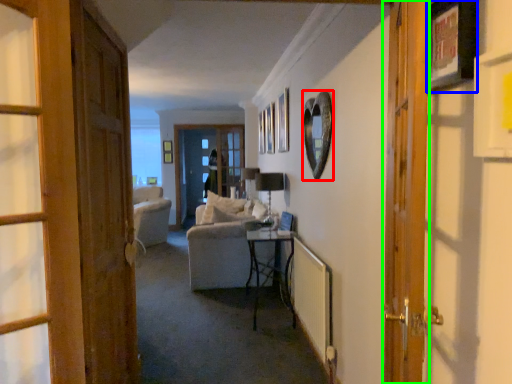
Question: Which object is positioned farthest from picture frame (highlighted by a red box)? Select from picture frame (highlighted by a blue box) and door (highlighted by a green box).

Choices:
 (A) picture frame
 (B) door

Answer: (A)